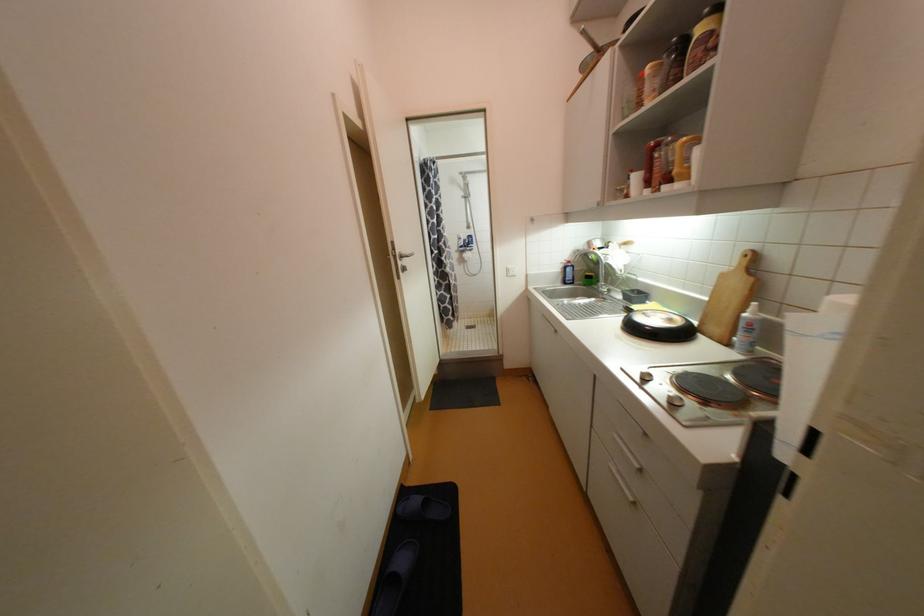
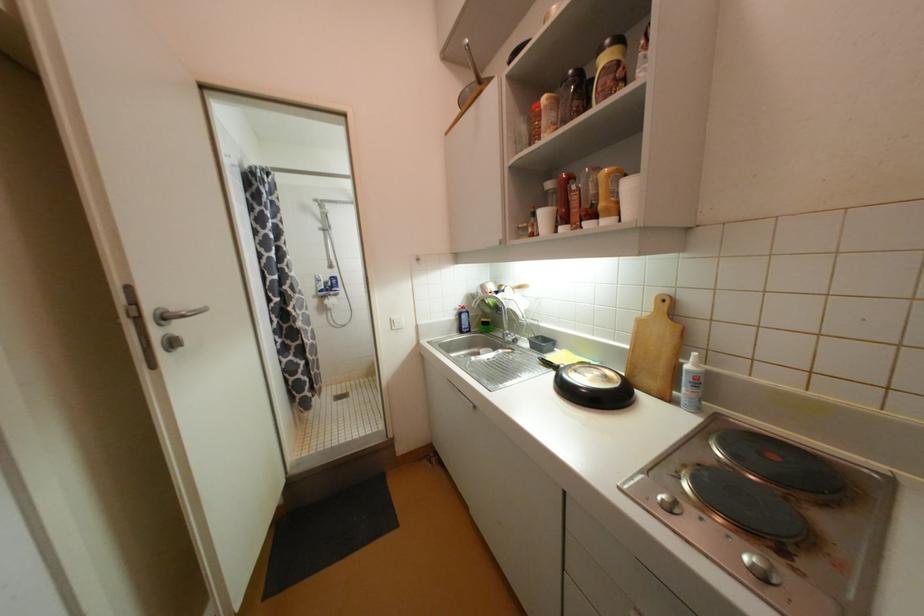
The point at (513, 270) is marked in the first image. Where is the corresponding point in the second image?

(396, 323)